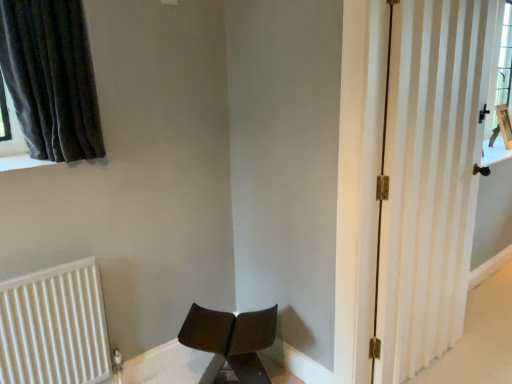
Question: Does white striped door at right appear on the left side of white ribbed radiator at lower left?

Choices:
 (A) yes
 (B) no

Answer: (B)

Question: Is white striped door at right next to white ribbed radiator at lower left?

Choices:
 (A) yes
 (B) no

Answer: (B)

Question: Considering the relative sizes of white striped door at right and white ribbed radiator at lower left in the image provided, is white striped door at right smaller than white ribbed radiator at lower left?

Choices:
 (A) yes
 (B) no

Answer: (B)

Question: Are white striped door at right and white ribbed radiator at lower left far apart?

Choices:
 (A) yes
 (B) no

Answer: (A)

Question: From a real-world perspective, is white striped door at right physically above white ribbed radiator at lower left?

Choices:
 (A) yes
 (B) no

Answer: (A)

Question: Choose the correct answer: Is white striped door at right inside white ribbed radiator at lower left or outside it?

Choices:
 (A) outside
 (B) inside

Answer: (A)

Question: Considering the positions of white striped door at right and white ribbed radiator at lower left in the image, is white striped door at right bigger or smaller than white ribbed radiator at lower left?

Choices:
 (A) big
 (B) small

Answer: (A)

Question: Considering the positions of point (396, 48) and point (91, 311), is point (396, 48) closer or farther from the camera than point (91, 311)?

Choices:
 (A) farther
 (B) closer

Answer: (B)

Question: In the image, is white striped door at right on the left side or the right side of white ribbed radiator at lower left?

Choices:
 (A) right
 (B) left

Answer: (A)

Question: Based on their sizes in the image, would you say white ribbed radiator at lower left is bigger or smaller than white striped door at right?

Choices:
 (A) small
 (B) big

Answer: (A)

Question: Based on their positions, is white ribbed radiator at lower left located to the left or right of white striped door at right?

Choices:
 (A) right
 (B) left

Answer: (B)

Question: Is point (74, 340) closer or farther from the camera than point (463, 77)?

Choices:
 (A) farther
 (B) closer

Answer: (B)

Question: From a real-world perspective, is white ribbed radiator at lower left above or below white striped door at right?

Choices:
 (A) above
 (B) below

Answer: (B)

Question: Would you say white striped door at right is inside or outside dark grey fabric curtain at upper left?

Choices:
 (A) inside
 (B) outside

Answer: (B)

Question: Is point (484, 28) positioned closer to the camera than point (60, 160)?

Choices:
 (A) closer
 (B) farther

Answer: (B)